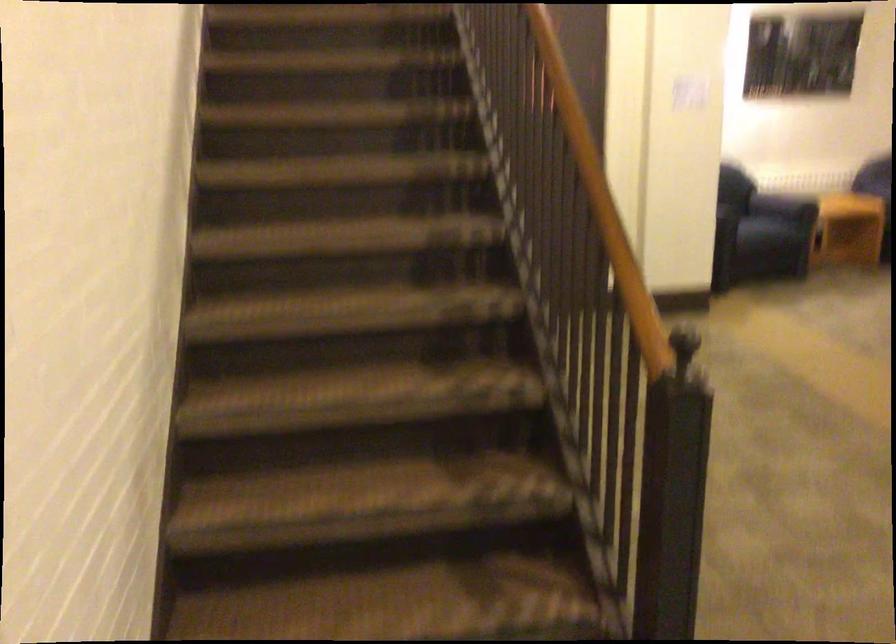
This screenshot has width=896, height=644. Find the location of `wooden stair handrail`. wooden stair handrail is located at coordinates (608, 216).